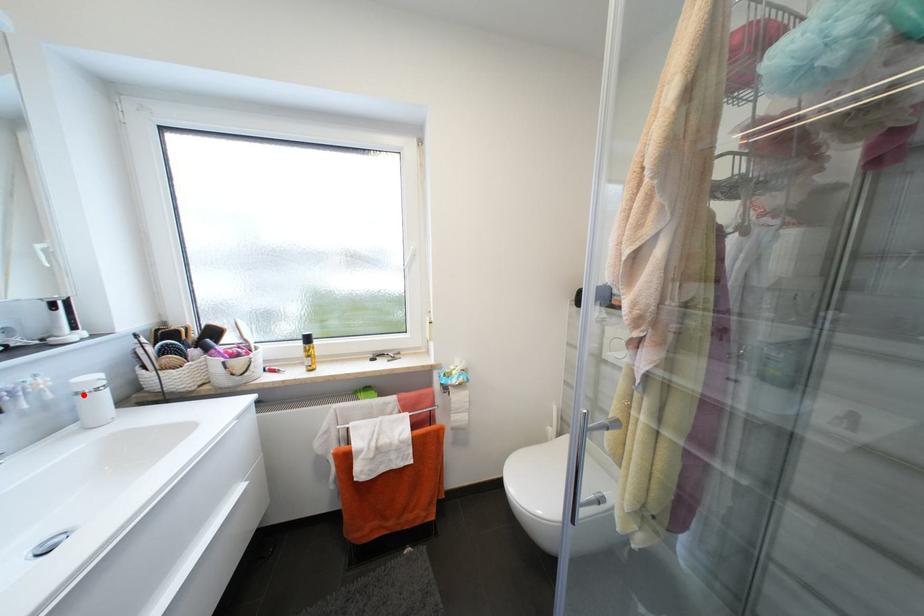
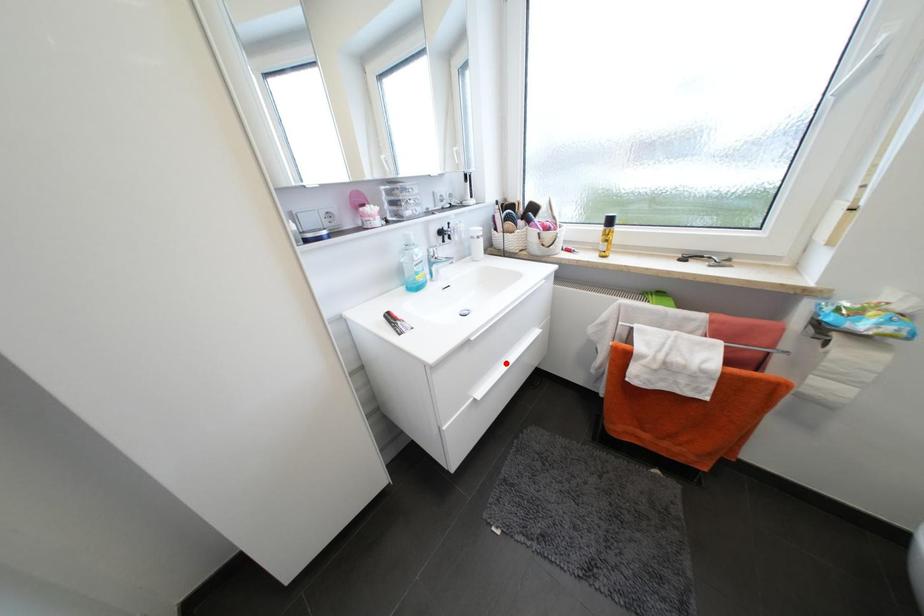
I am providing you with two images of the same scene from different viewpoints. A red point is marked on the first image and another point is marked on the second image. Does the point marked in image1 correspond to the same location as the one in image2?

No